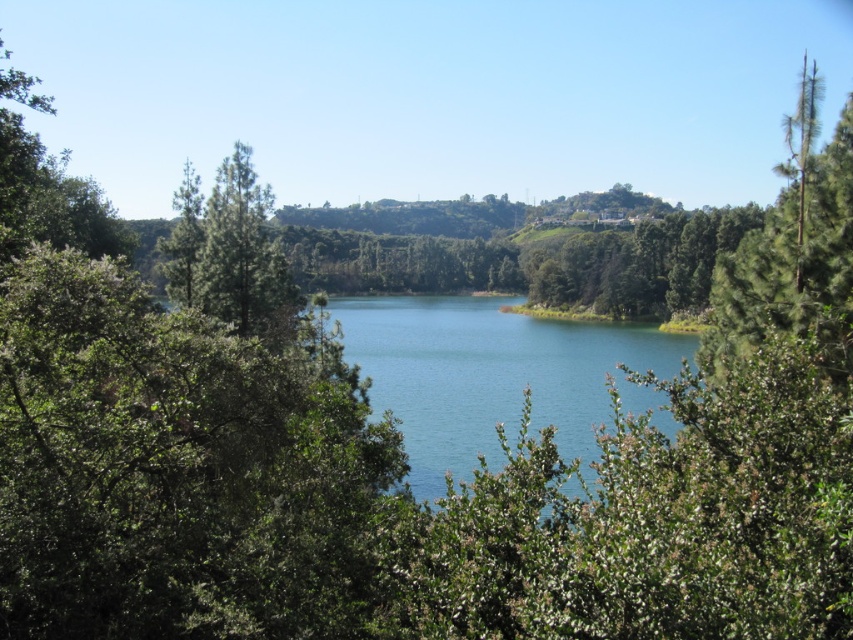
Does clear blue water at center have a lesser width compared to green rough bark tree at right?

Indeed, clear blue water at center has a lesser width compared to green rough bark tree at right.

Between clear blue water at center and green rough bark tree at right, which one is positioned higher?

Positioned higher is green rough bark tree at right.

Is point (444, 424) positioned in front of point (804, 156)?

That is False.

This screenshot has height=640, width=853. I want to click on clear blue water at center, so click(x=494, y=376).